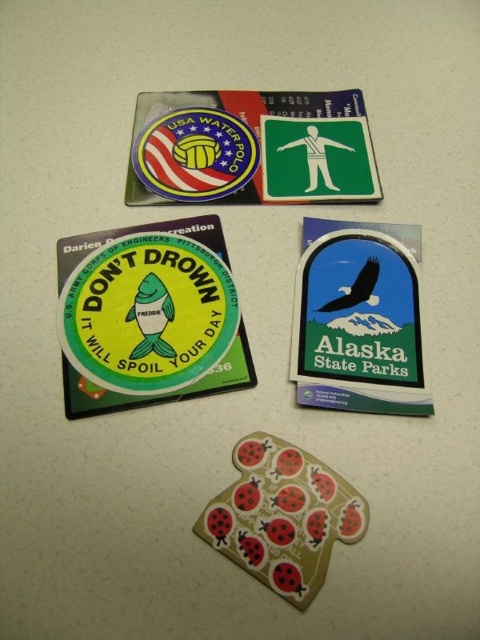
You are organizing a sticker collection and want to arrange the green matte sticker at lower left and the metallic gold ladybug at center based on their height. Which sticker should you place higher up if you want the taller one to be above the shorter one?

The green matte sticker at lower left is taller than the metallic gold ladybug at center, so you should place the green matte sticker at lower left higher up to have the taller one above the shorter one.

You are organizing a sticker collection and need to place the green matte sticker at lower left and metallic gold ladybug at center into a display case. The case has a height limit of 10 cm. Can both stickers fit vertically without overlapping?

The green matte sticker at lower left is larger in size than metallic gold ladybug at center, but without specific height measurements, it is impossible to determine if they can fit within the 10 cm height limit. Additional information about their individual heights is needed.